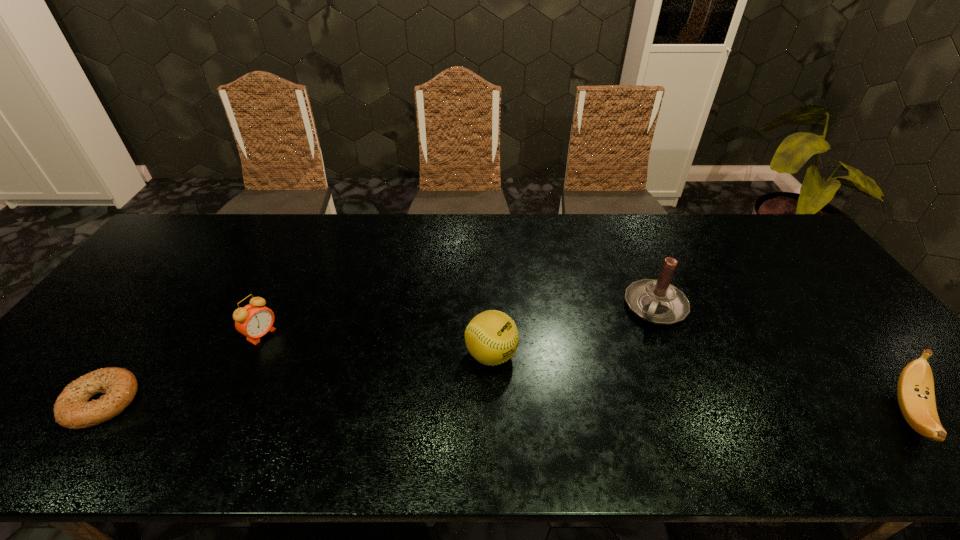
Find the location of `the leftmost object`. the leftmost object is located at coordinates (72, 410).

Image resolution: width=960 pixels, height=540 pixels. Find the location of `bagel`. bagel is located at coordinates (72, 410).

At what (x,y) coordinates should I click in order to perform the action: click on the tallest object. Please return your answer as a coordinate pair (x, y). This screenshot has height=540, width=960. Looking at the image, I should click on (657, 301).

You are a GUI agent. You are given a task and a screenshot of the screen. Output one action in this format:
    pyautogui.click(x=<x>, y=<y>)
    Task: Click on the candle
    
    Given the screenshot: What is the action you would take?
    pyautogui.click(x=657, y=301)

You are a GUI agent. You are given a task and a screenshot of the screen. Output one action in this format:
    pyautogui.click(x=<x>, y=<y>)
    Task: Click on the alarm clock
    
    Given the screenshot: What is the action you would take?
    pyautogui.click(x=255, y=320)

Locate an element on the screen. The width and height of the screenshot is (960, 540). softball is located at coordinates (491, 337).

The height and width of the screenshot is (540, 960). In order to click on free space located 0.050m on the left of the leftmost object in this screenshot , I will do tap(46, 402).

Locate an element on the screen. This screenshot has height=540, width=960. blank space located on the side of the candle with the handle loop is located at coordinates (625, 379).

Locate an element on the screen. This screenshot has width=960, height=540. vacant position located 0.150m on the side of the candle with the handle loop is located at coordinates (630, 367).

I want to click on free space located 0.100m on the side of the candle with the handle loop, so click(636, 354).